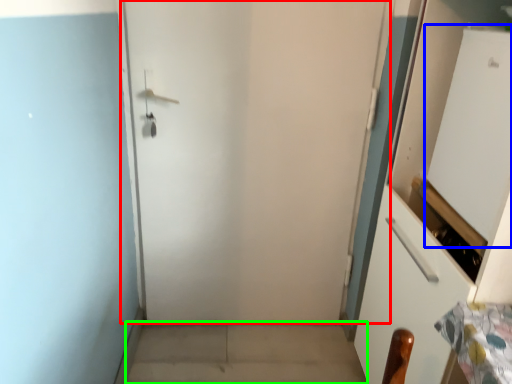
Question: Estimate the real-world distances between objects in this image. Which object is farther from door (highlighted by a red box), screen door (highlighted by a blue box) or concrete (highlighted by a green box)?

Choices:
 (A) screen door
 (B) concrete

Answer: (A)